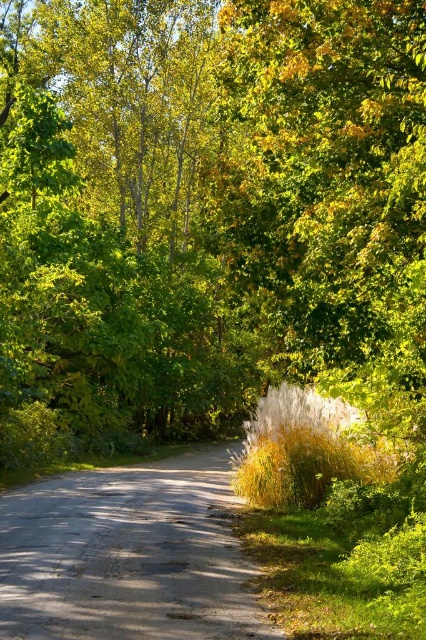
Question: Which of the following is the closest to the observer?

Choices:
 (A) (23, 579)
 (B) (5, 221)

Answer: (A)

Question: Where is green leafy tree at center located in relation to smooth asphalt road at center in the image?

Choices:
 (A) left
 (B) right

Answer: (B)

Question: Which point is farther to the camera?

Choices:
 (A) green leafy tree at center
 (B) smooth asphalt road at center

Answer: (A)

Question: Which of the following is the farthest from the observer?

Choices:
 (A) green leafy tree at center
 (B) smooth asphalt road at center

Answer: (A)

Question: Can you confirm if green leafy tree at center is thinner than smooth asphalt road at center?

Choices:
 (A) no
 (B) yes

Answer: (A)

Question: Does green leafy tree at center appear on the right side of smooth asphalt road at center?

Choices:
 (A) no
 (B) yes

Answer: (B)